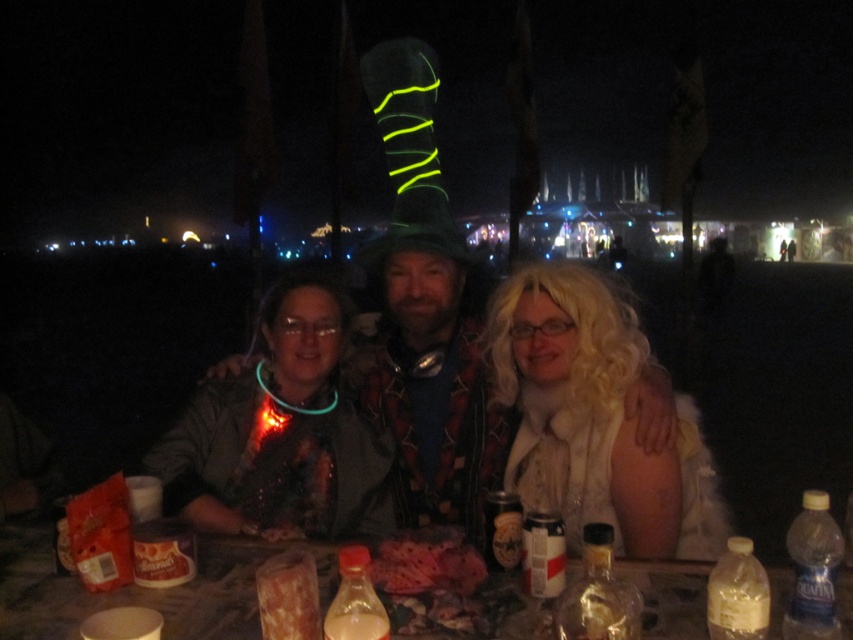
Question: Does translucent plastic bottle at lower right come behind translucent plastic bottle at center?

Choices:
 (A) no
 (B) yes

Answer: (B)

Question: Among these points, which one is nearest to the camera?

Choices:
 (A) (798, 566)
 (B) (543, 538)
 (C) (335, 609)
 (D) (595, 378)

Answer: (C)

Question: Can you confirm if neon green felt hat at center is positioned to the left of translucent plastic can at center?

Choices:
 (A) no
 (B) yes

Answer: (B)

Question: Is translucent plastic bag at lower center below clear plastic bottle at lower right?

Choices:
 (A) yes
 (B) no

Answer: (A)

Question: Which object is closer to the camera taking this photo?

Choices:
 (A) translucent glass bottle at center
 (B) clear plastic bottle at lower right

Answer: (A)

Question: Which point appears farthest from the camera in this image?

Choices:
 (A) [x=445, y=465]
 (B) [x=358, y=609]

Answer: (A)